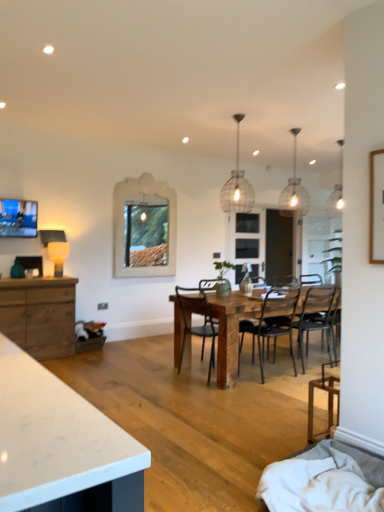
Question: From the image's perspective, relative to natural wood cabinet at left, is wooden chair at lower right, the 1th chair when ordered from front to back, above or below?

Choices:
 (A) below
 (B) above

Answer: (A)

Question: Does point (332, 390) appear closer or farther from the camera than point (64, 318)?

Choices:
 (A) farther
 (B) closer

Answer: (B)

Question: Estimate the real-world distances between objects in this image. Which object is farther from the woven wood pendant light at upper center, the second light fixture in the back-to-front sequence?

Choices:
 (A) transparent glass door at center
 (B) matte white lampshade at left
 (C) woven wire pendant light at center, which is the 1th light fixture in front-to-back order
 (D) metallic black chair at center, the 3th chair from the back
 (E) white textured mirror at upper center

Answer: (B)

Question: Based on their relative distances, which object is nearer to the black metal chair at center, which is the second chair in back-to-front order?

Choices:
 (A) white textured mirror at upper center
 (B) transparent glass door at center
 (C) metallic black chair at center, the 3th chair from the back
 (D) natural wood cabinet at left
 (E) woven wood pendant light at upper center, the 2th light fixture from the right

Answer: (C)